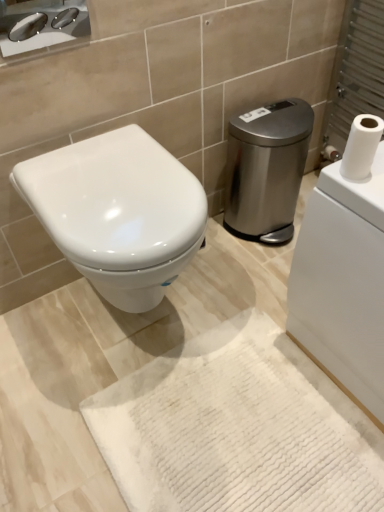
Question: Is white matte toilet paper at upper right positioned before white textured bath mat at center?

Choices:
 (A) no
 (B) yes

Answer: (A)

Question: Is white matte toilet paper at upper right facing towards white textured bath mat at center?

Choices:
 (A) no
 (B) yes

Answer: (A)

Question: Could white textured bath mat at center be considered to be inside white matte toilet paper at upper right?

Choices:
 (A) no
 (B) yes

Answer: (A)

Question: Does white matte toilet paper at upper right appear on the left side of white textured bath mat at center?

Choices:
 (A) no
 (B) yes

Answer: (A)

Question: Does white matte toilet paper at upper right have a larger size compared to white textured bath mat at center?

Choices:
 (A) yes
 (B) no

Answer: (B)

Question: From the image's perspective, does white matte toilet paper at upper right appear lower than white textured bath mat at center?

Choices:
 (A) no
 (B) yes

Answer: (A)

Question: Is satin silver trash can at center right outside white glossy toilet at center?

Choices:
 (A) yes
 (B) no

Answer: (A)

Question: From a real-world perspective, is satin silver trash can at center right physically above white glossy toilet at center?

Choices:
 (A) no
 (B) yes

Answer: (A)

Question: Is the depth of satin silver trash can at center right less than that of white glossy toilet at center?

Choices:
 (A) yes
 (B) no

Answer: (B)

Question: Does satin silver trash can at center right have a greater width compared to white glossy toilet at center?

Choices:
 (A) yes
 (B) no

Answer: (B)

Question: From the image's perspective, is satin silver trash can at center right over white glossy toilet at center?

Choices:
 (A) no
 (B) yes

Answer: (B)

Question: Is white glossy toilet at center completely or partially inside satin silver trash can at center right?

Choices:
 (A) no
 (B) yes

Answer: (A)

Question: Considering the relative sizes of satin silver trash can at center right and white matte toilet paper at upper right in the image provided, is satin silver trash can at center right smaller than white matte toilet paper at upper right?

Choices:
 (A) yes
 (B) no

Answer: (B)